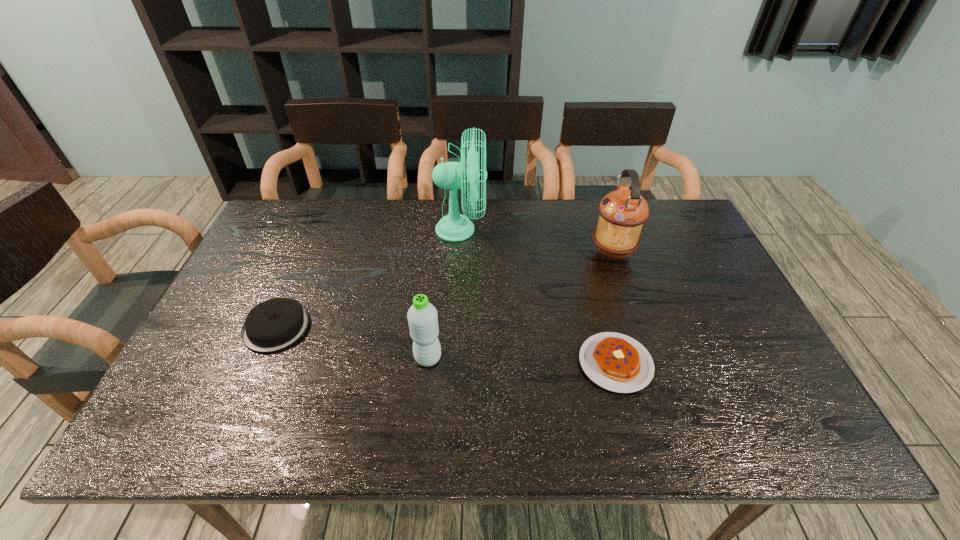
Where is `vacant space at the far right corner`? The image size is (960, 540). vacant space at the far right corner is located at coordinates (685, 218).

The height and width of the screenshot is (540, 960). What are the coordinates of `vacant space at the near right corner` in the screenshot? It's located at (749, 420).

The image size is (960, 540). I want to click on vacant space that's between the oil lamp and the tallest object, so click(537, 241).

Locate an element on the screen. This screenshot has width=960, height=540. vacant area between the second tallest object and the fan is located at coordinates (537, 241).

The width and height of the screenshot is (960, 540). What are the coordinates of `blank region between the oil lamp and the fan` in the screenshot? It's located at (537, 241).

Locate an element on the screen. free spot between the second tallest object and the leftmost object is located at coordinates click(x=444, y=291).

Locate an element on the screen. free space between the third tallest object and the second tallest object is located at coordinates coord(520,306).

Identify the location of free space that is in between the fan and the second shortest object. Image resolution: width=960 pixels, height=540 pixels. (369, 279).

Find the location of a particular element. The height and width of the screenshot is (540, 960). vacant point located between the oil lamp and the fan is located at coordinates (537, 241).

I want to click on empty location between the shorter pancake and the water bottle, so [x=522, y=361].